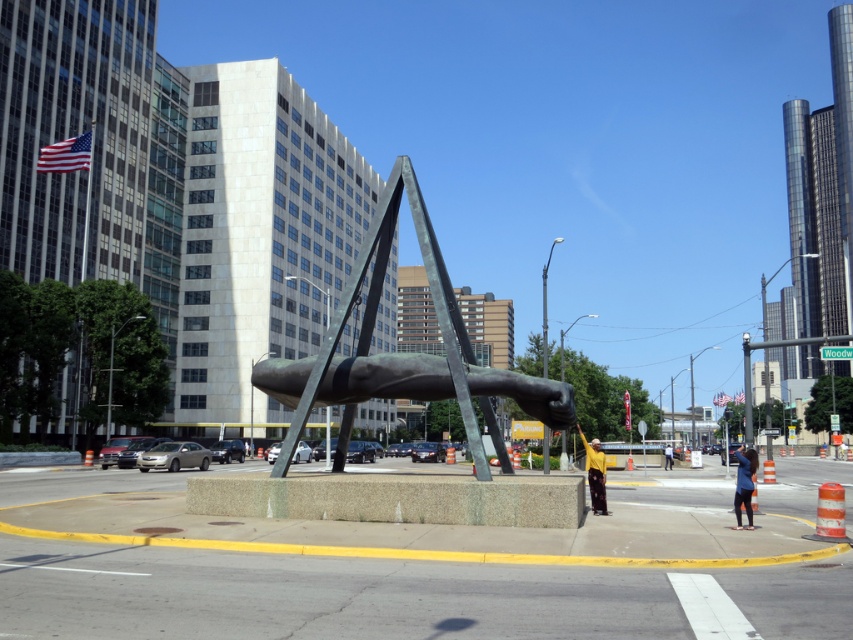
You are a photographer standing at the city intersection where the bronze sculpture at center and the yellow matte shirt at center are located. You want to take a photo that captures both objects clearly. Based on their positions, which object should you focus on first to ensure both are in sharp focus?

The bronze sculpture at center is in front of the yellow matte shirt at center, so you should focus on the bronze sculpture at center first to ensure both are in sharp focus.

You are a delivery person carrying a package that requires a 15 meter clearance to avoid damage. You need to pass through the area between the yellow matte shirt at center and the dark blue jeans at center. Will the space between them allow safe passage for your package?

The distance between the yellow matte shirt at center and the dark blue jeans at center is 14.20 meters, which is less than the required 15 meters clearance. Therefore, the space is not sufficient for safe passage of the package.

You are standing at the center of the city intersection facing the large abstract sculpture. There are two points marked on the sculpture. The first point is at coordinate point (753,472) and the second is at point (664,451). Which point is closer to you?

Point (753,472) is closer to the viewer than point (664,451).